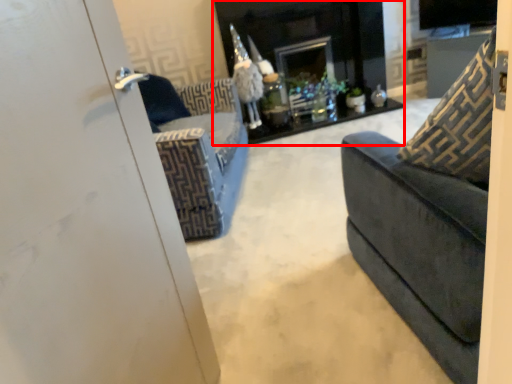
Question: From the image, what is the correct spatial relationship of fireplace (annotated by the red box) in relation to throw pillow?

Choices:
 (A) right
 (B) left

Answer: (B)